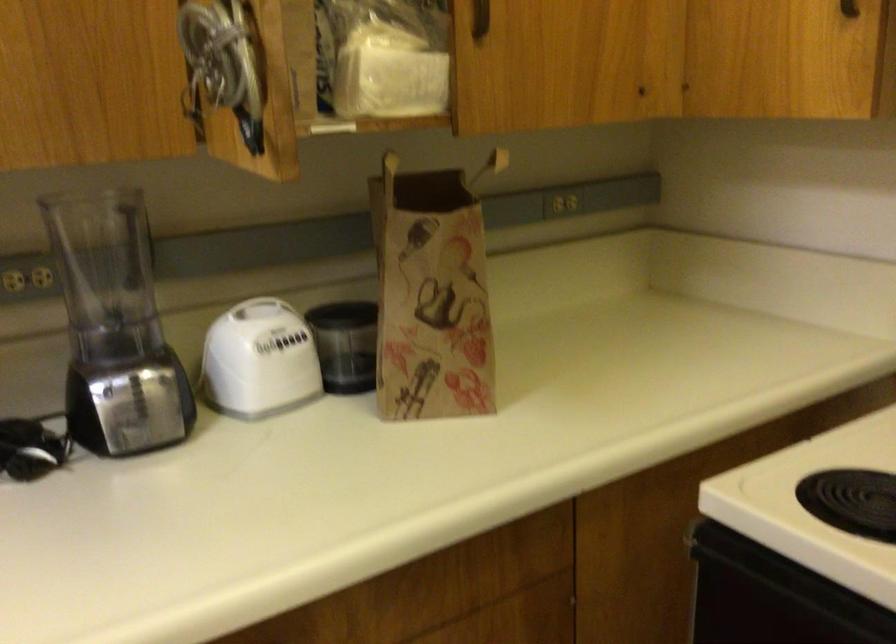
What are the coordinates of `white appliance handle` in the screenshot? It's located at (260, 308).